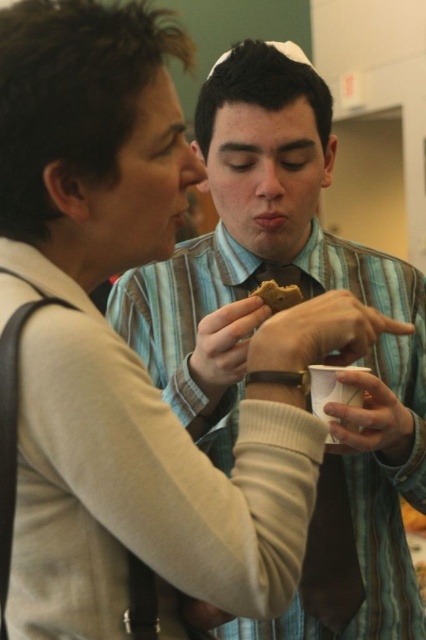
You are at a party and want to place a brown crumbly cookie at center on the table without it touching the matte brown tie at center. Given their positions, which side of the table should you place the cookie on?

The matte brown tie at center is to the right of the brown crumbly cookie at center, so to prevent the cookie from touching the tie, you should place the cookie on the left side of the table.

You are a photographer trying to capture a closeup of the matte brown tie at center and the brown crumbly cookie at center. Which object should you focus on first to ensure both are in focus?

The matte brown tie at center is closer to the viewer than the brown crumbly cookie at center, so focus on the matte brown tie at center first to ensure both are in focus.